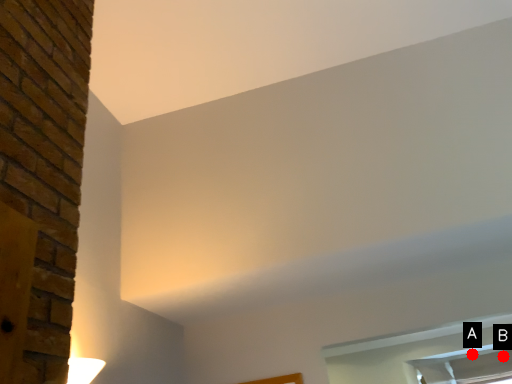
Question: Two points are circled on the image, labeled by A and B beside each circle. Which of the following is the closest to the observer?

Choices:
 (A) A is closer
 (B) B is closer

Answer: (B)